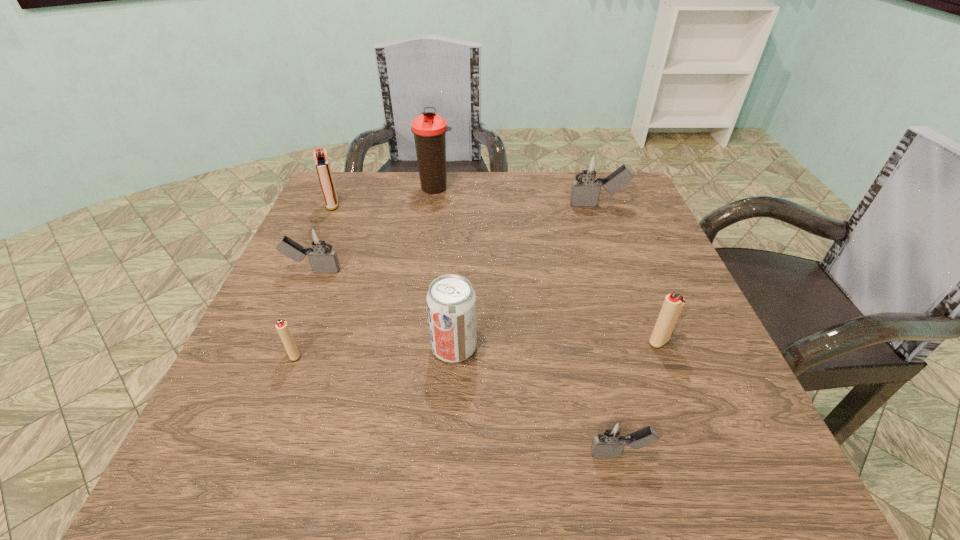
Point out which igniter is positioned as the fourth nearest to the rightmost red igniter. Please provide its 2D coordinates. Your answer should be formatted as a tuple, i.e. [(x, y)], where the tuple contains the x and y coordinates of a point satisfying the conditions above.

[(318, 247)]

At what (x,y) coordinates should I click in order to perform the action: click on red igniter object that ranks as the second closest to the smallest red igniter. Please return your answer as a coordinate pair (x, y). Looking at the image, I should click on (672, 307).

Where is `red igniter identified as the second closest to the farthest gray igniter`? Image resolution: width=960 pixels, height=540 pixels. red igniter identified as the second closest to the farthest gray igniter is located at coordinates (322, 164).

At what (x,y) coordinates should I click in order to perform the action: click on gray igniter that is the closest one to the nearest object. Please return your answer as a coordinate pair (x, y). Looking at the image, I should click on (318, 247).

You are a GUI agent. You are given a task and a screenshot of the screen. Output one action in this format:
    pyautogui.click(x=<x>, y=<y>)
    Task: Click on the second closest gray igniter to the soda can
    
    Given the screenshot: What is the action you would take?
    pyautogui.click(x=318, y=247)

At what (x,y) coordinates should I click in order to perform the action: click on vacant space that satisfies the following two spatial constraints: 1. on the front side of the soda can; 2. on the right side of the fourth farthest object. Please return your answer as a coordinate pair (x, y). This screenshot has width=960, height=540. Looking at the image, I should click on (280, 347).

The height and width of the screenshot is (540, 960). In order to click on vacant position in the image that satisfies the following two spatial constraints: 1. on the front side of the nearest gray igniter; 2. on the left side of the fourth nearest igniter in this screenshot , I will do pos(235,454).

You are a GUI agent. You are given a task and a screenshot of the screen. Output one action in this format:
    pyautogui.click(x=<x>, y=<y>)
    Task: Click on the vacant space that satisfies the following two spatial constraints: 1. on the front side of the soda can; 2. on the right side of the thermos bottle
    The height and width of the screenshot is (540, 960).
    Given the screenshot: What is the action you would take?
    pyautogui.click(x=413, y=347)